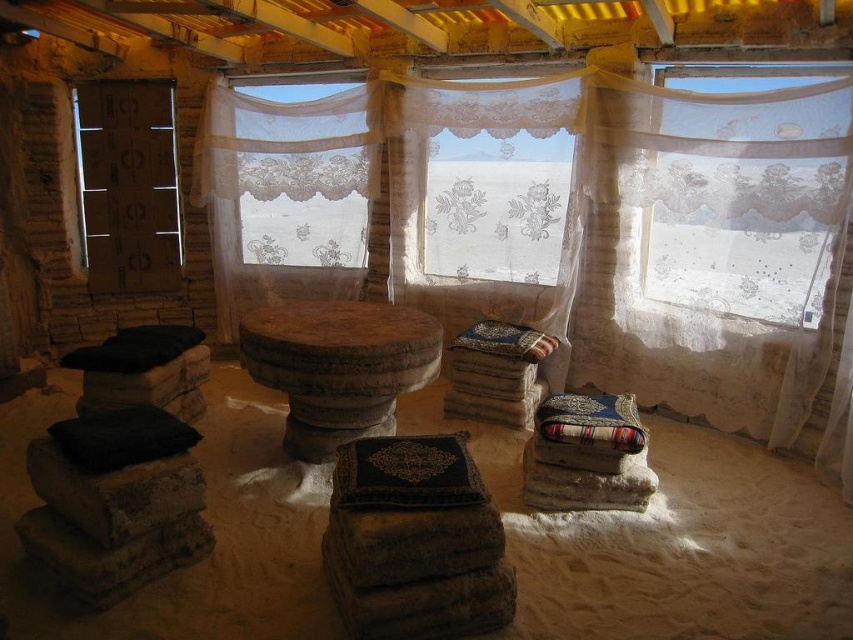
Question: Does translucent lace curtain at upper right have a larger size compared to rustic wood table at center?

Choices:
 (A) yes
 (B) no

Answer: (A)

Question: Does rustic wood table at center have a larger size compared to patterned fabric pillow at center?

Choices:
 (A) yes
 (B) no

Answer: (A)

Question: Which object is positioned farthest from the translucent lace curtain at upper right?

Choices:
 (A) rustic wood table at center
 (B) patterned fabric pillow at center
 (C) black soft pillow at lower left
 (D) multicolored woven pillow at lower right

Answer: (C)

Question: Can you confirm if matte cardboard at left is bigger than black soft pillow at lower left?

Choices:
 (A) no
 (B) yes

Answer: (B)

Question: Which point is farther to the camera?

Choices:
 (A) multicolored woven pillow at lower right
 (B) rustic wood table at center
 (C) matte cardboard at left
 (D) black soft pillow at lower left

Answer: (C)

Question: Which of the following is the closest to the observer?

Choices:
 (A) translucent lace curtain at upper right
 (B) black soft pillow at lower left
 (C) patterned fabric pillow at center

Answer: (B)